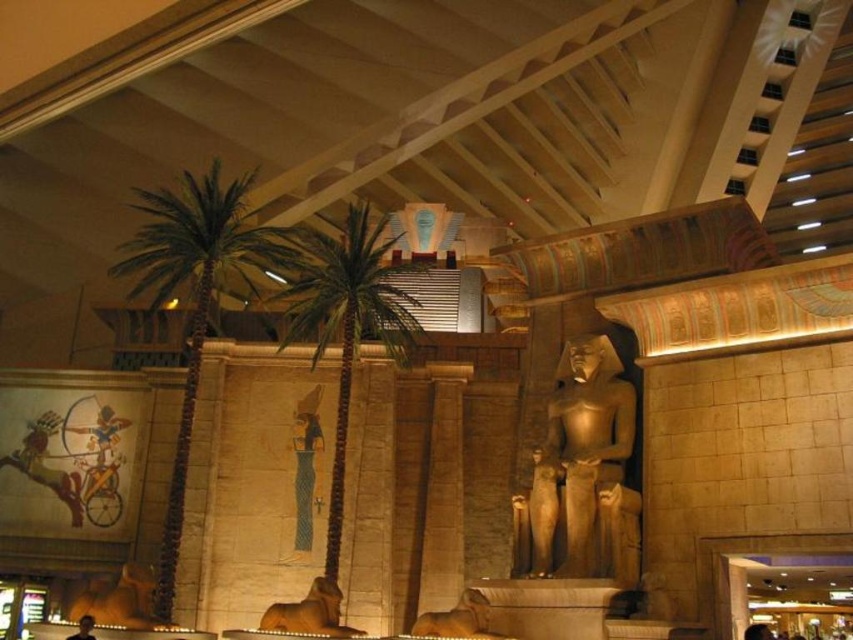
Does green leafy palm tree at center come in front of brown stone elephant at lower center?

No, it is not.

Where is `green leafy palm tree at center`? This screenshot has height=640, width=853. green leafy palm tree at center is located at coordinates (344, 320).

Who is shorter, gold leaf statue at center or brown stone elephant at lower center?

brown stone elephant at lower center is shorter.

Does point (309, 428) come in front of point (311, 614)?

No, (309, 428) is further to viewer.

Find the location of a particular element. This screenshot has width=853, height=640. gold leaf statue at center is located at coordinates (305, 465).

From the picture: Is golden stone statue at center below green leafy palm tree at left?

Correct, golden stone statue at center is located below green leafy palm tree at left.

Who is more distant from viewer, (564, 522) or (254, 173)?

The point (254, 173) is more distant.

Does point (582, 499) come in front of point (173, 522)?

Yes, point (582, 499) is closer to viewer.

Locate an element on the screen. The height and width of the screenshot is (640, 853). golden stone statue at center is located at coordinates (581, 474).